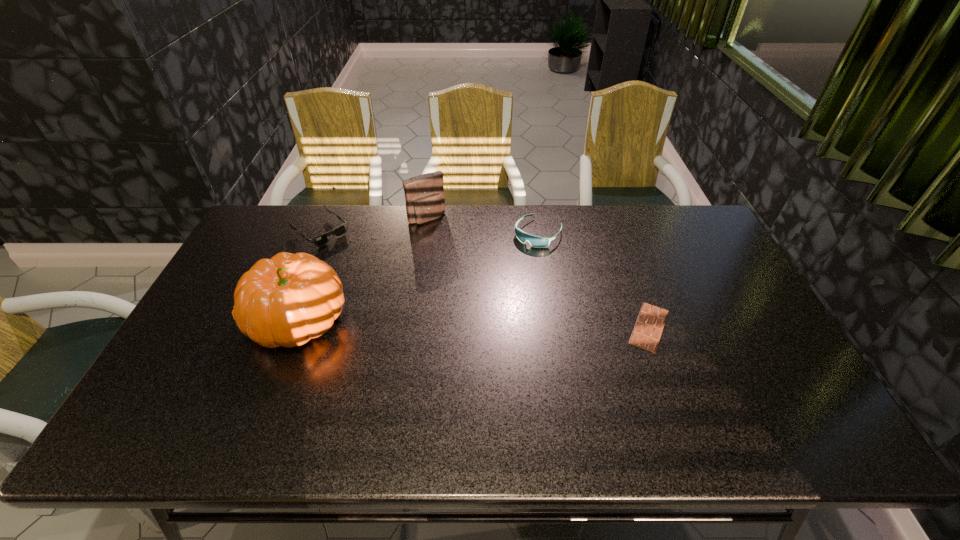
I want to click on vacant space on the desktop that is between the pumpkin and the chocolate bar and is positioned on the front-facing side of the second object from right to left, so click(462, 322).

Locate an element on the screen. free space on the desktop that is between the pumpkin and the shortest object and is positioned on the temples of the fourth tallest object is located at coordinates (425, 321).

Locate an element on the screen. Image resolution: width=960 pixels, height=540 pixels. vacant space on the desktop that is between the pumpkin and the shortest object and is positioned with an open flap on the fourth shortest object is located at coordinates (511, 323).